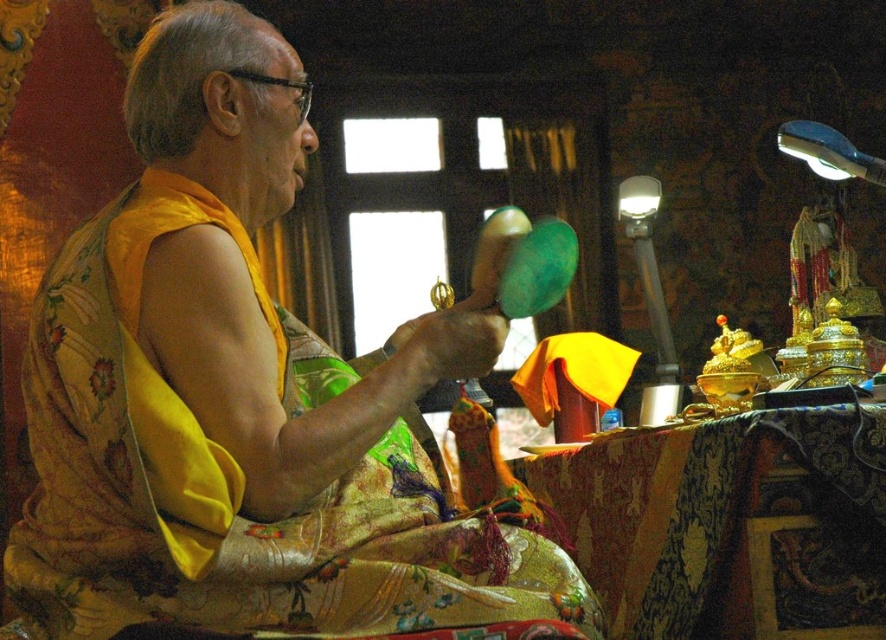
Question: Does silky yellow robe at center appear on the right side of gold-patterned cloth at lower right?

Choices:
 (A) no
 (B) yes

Answer: (A)

Question: Can you confirm if silky yellow robe at center is positioned to the left of gold-patterned cloth at lower right?

Choices:
 (A) no
 (B) yes

Answer: (B)

Question: Among these points, which one is farthest from the camera?

Choices:
 (A) (125, 362)
 (B) (607, 458)

Answer: (B)

Question: Is silky yellow robe at center further to camera compared to gold-patterned cloth at lower right?

Choices:
 (A) no
 (B) yes

Answer: (A)